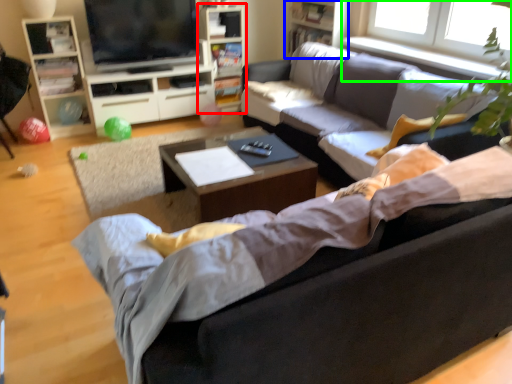
Question: Based on their relative distances, which object is nearer to bookshelf (highlighted by a red box)? Choose from bookshelf (highlighted by a blue box) and window (highlighted by a green box).

Choices:
 (A) bookshelf
 (B) window

Answer: (A)